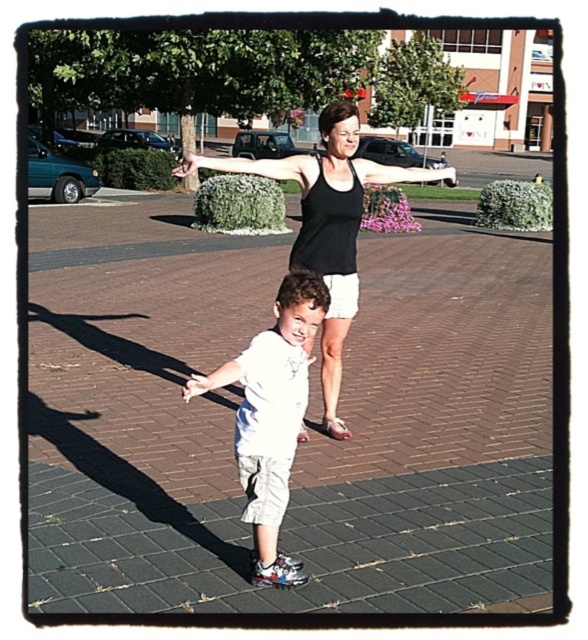
You are a photographer trying to capture a closeup of the child while ensuring both the brick pavement at center and the smooth skin hand at center are visible in the frame. Given their sizes, which object will require more careful framing to avoid being cut off?

The brick pavement at center has a larger width than the smooth skin hand at center, so it will require more careful framing to avoid being cut off.

You are standing in the plaza and see two points marked in the image. Which point is closer to you, point (149, 570) or point (386, 168)?

Point (149, 570) is closer to the camera than point (386, 168).

You are a photographer trying to capture the child in the scene. You notice the white fabric arm at center and the white matte hand at center. Which object would you need to adjust your focus settings for to ensure clarity when they are both in the frame?

The white fabric arm at center is wider than the white matte hand at center, so you should adjust your focus settings to accommodate the larger width of the white fabric arm at center to ensure both are clear.